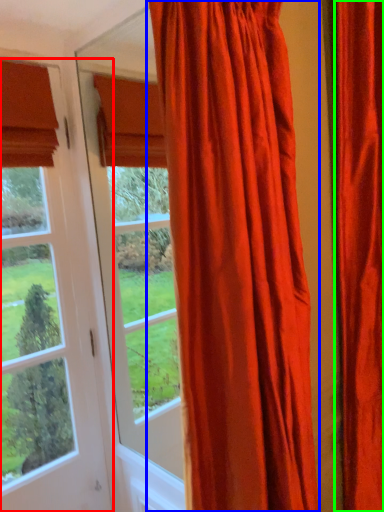
Question: Estimate the real-world distances between objects in this image. Which object is closer to window (highlighted by a red box), curtain (highlighted by a blue box) or curtain (highlighted by a green box)?

Choices:
 (A) curtain
 (B) curtain

Answer: (A)